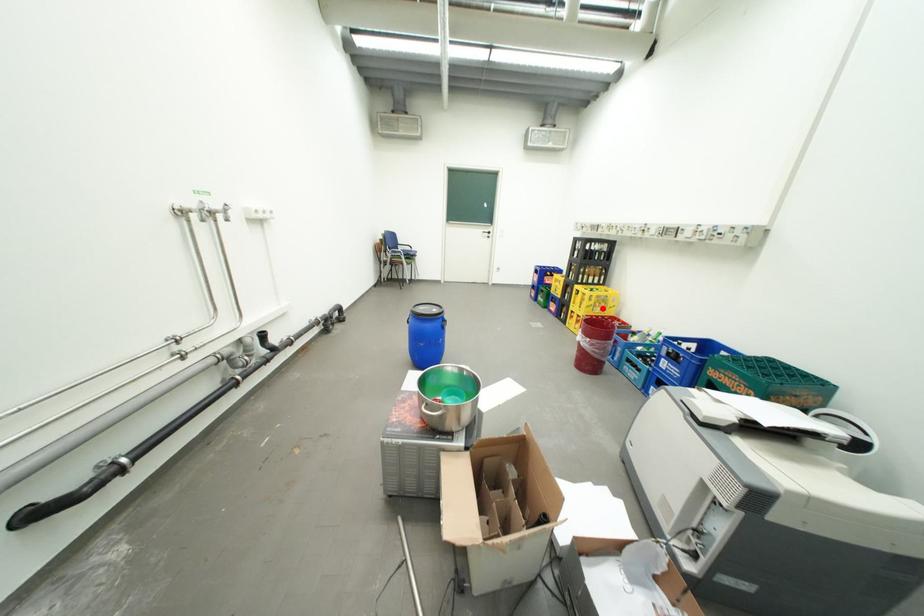
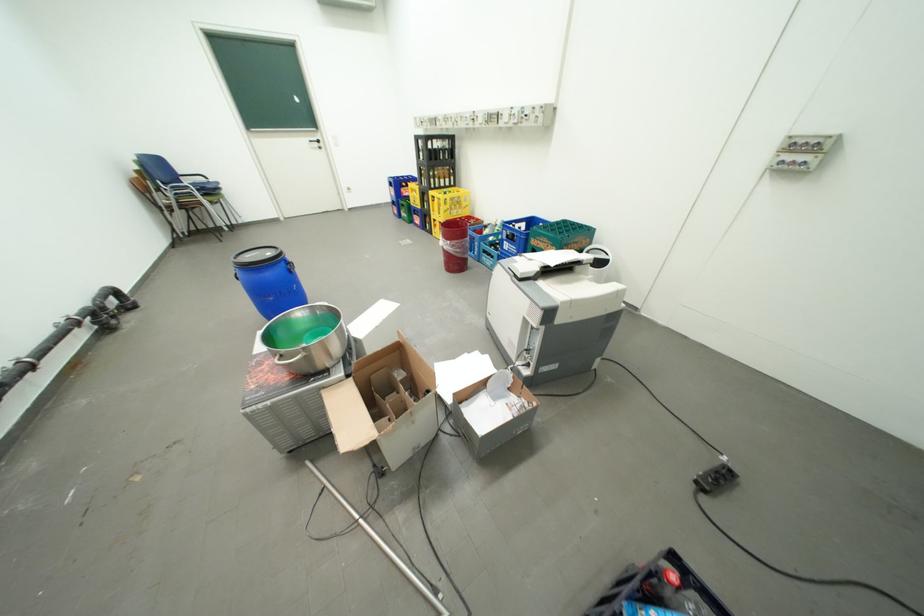
In the second image, find the point that corresponds to the highlighted location in the first image.

(459, 212)